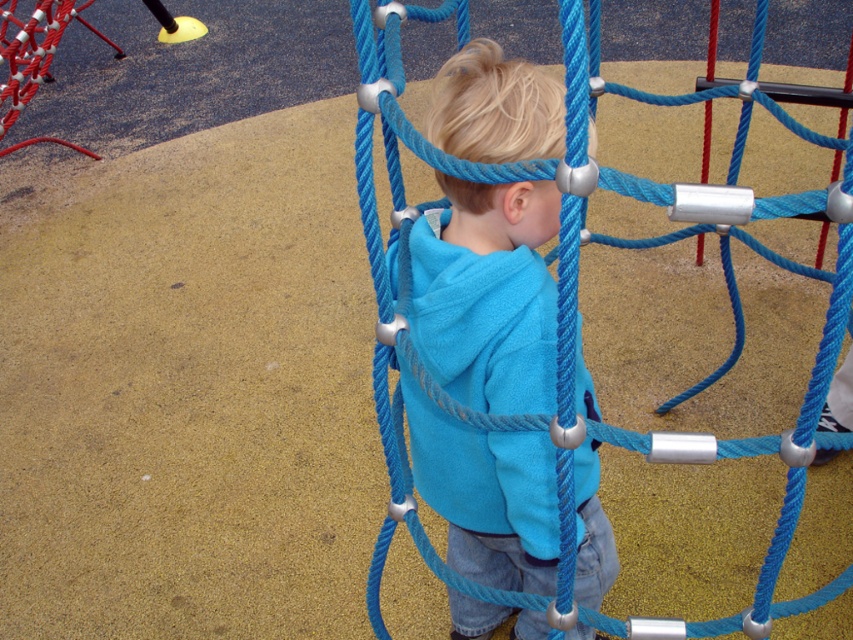
Can you confirm if blue fleece jacket at center is shorter than blue rope net at center?

No, blue fleece jacket at center is not shorter than blue rope net at center.

Is point (583, 548) positioned after point (556, 468)?

Yes, point (583, 548) is behind point (556, 468).

Where is `blue fleece jacket at center`? The width and height of the screenshot is (853, 640). blue fleece jacket at center is located at coordinates (486, 294).